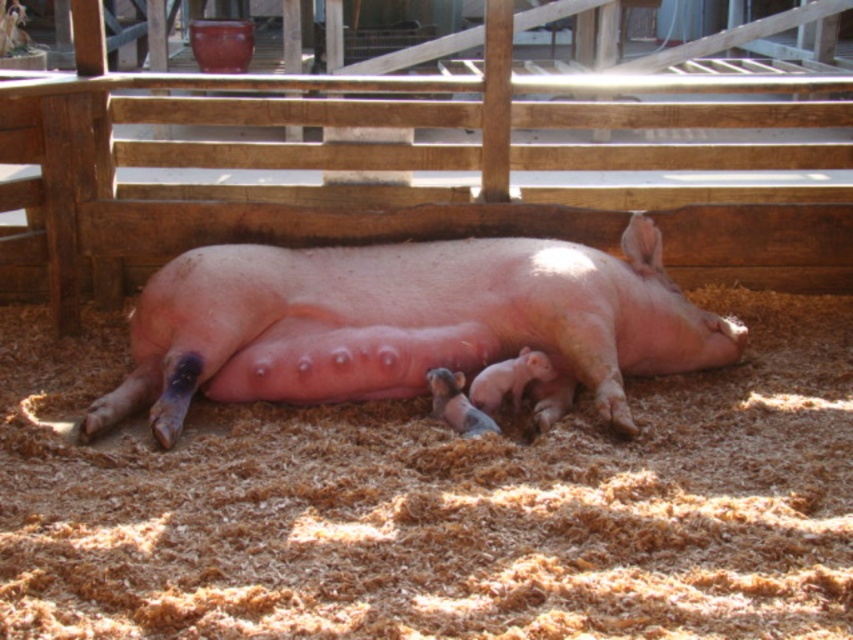
Where is the brown sawdust at center located in the image?

The brown sawdust at center is located at point (x=436, y=504).

You are a farmer checking the barn. You see the brown sawdust at center and the pink smooth pig at center. Which object is closer to the ground?

The brown sawdust at center is located below the pink smooth pig at center, so it is closer to the ground.

You are standing in front of the pig and want to place two markers at the coordinates point [242,592] and point [653,248]. Which marker will be closer to your viewpoint?

Point [242,592] is closer to the camera than point [653,248], so the marker at point [242,592] will be closer to your viewpoint.